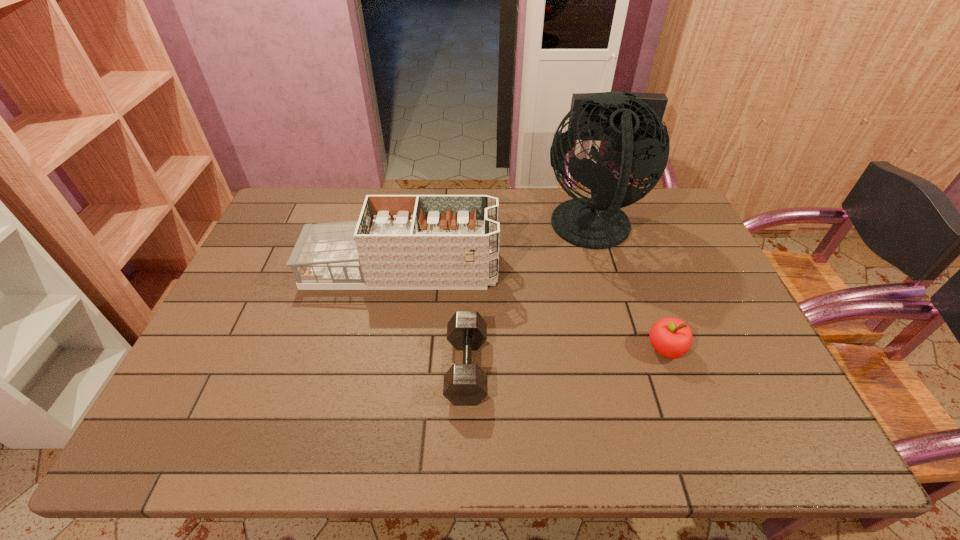
Where is `the tallest object`? the tallest object is located at coordinates (634, 129).

The height and width of the screenshot is (540, 960). In order to click on the third shortest object in this screenshot , I will do click(x=401, y=242).

The height and width of the screenshot is (540, 960). What are the coordinates of `the second shortest object` in the screenshot? It's located at (672, 338).

Locate an element on the screen. dumbbell is located at coordinates (466, 384).

You are a GUI agent. You are given a task and a screenshot of the screen. Output one action in this format:
    pyautogui.click(x=<x>, y=<y>)
    Task: Click on the vacant region located 0.060m on the front-facing side of the tallest object
    This screenshot has height=540, width=960.
    Given the screenshot: What is the action you would take?
    pyautogui.click(x=524, y=230)

At what (x,y) coordinates should I click in order to perform the action: click on vacant region located 0.330m on the front-facing side of the tallest object. Please return your answer as a coordinate pair (x, y). Looking at the image, I should click on (441, 230).

Identify the location of vacant space located on the front-facing side of the tallest object. (420, 230).

Where is `vacant space located 0.370m at the entrance of the dollhouse`? vacant space located 0.370m at the entrance of the dollhouse is located at coordinates (622, 269).

I want to click on vacant area situated on the left of the apple, so click(487, 349).

I want to click on blank space located 0.250m on the back of the shortest object, so click(x=469, y=267).